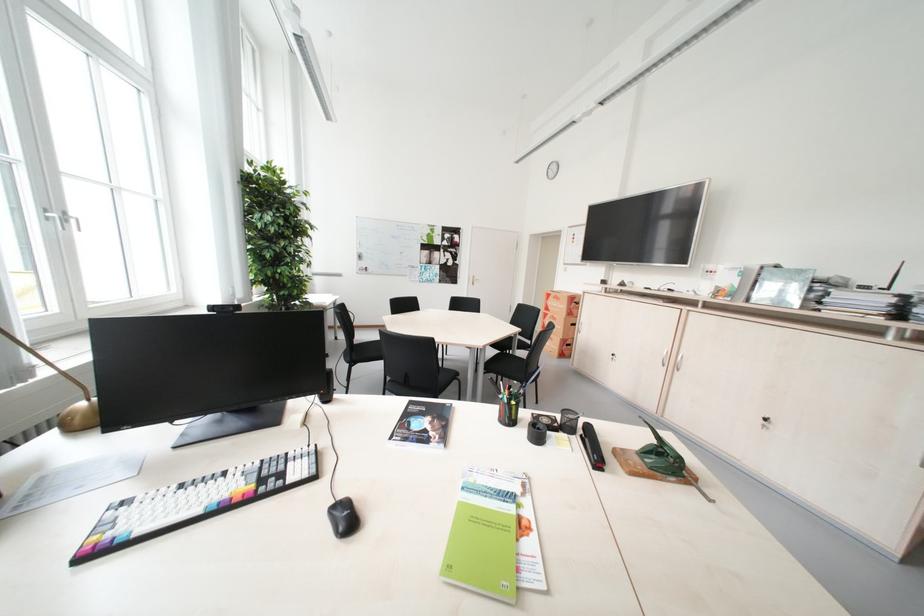
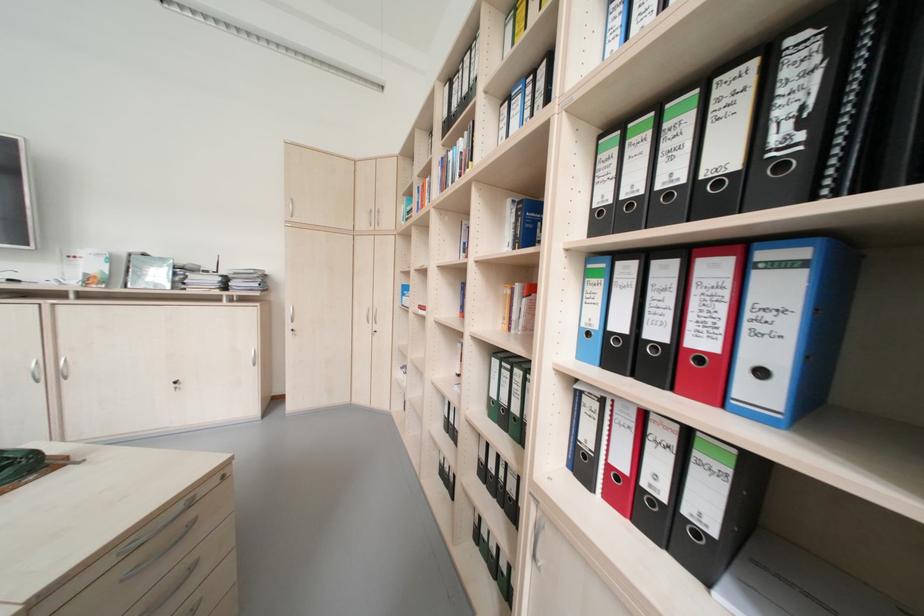
Where in the second image is the point corresponding to [682,367] from the first image?

(65, 377)